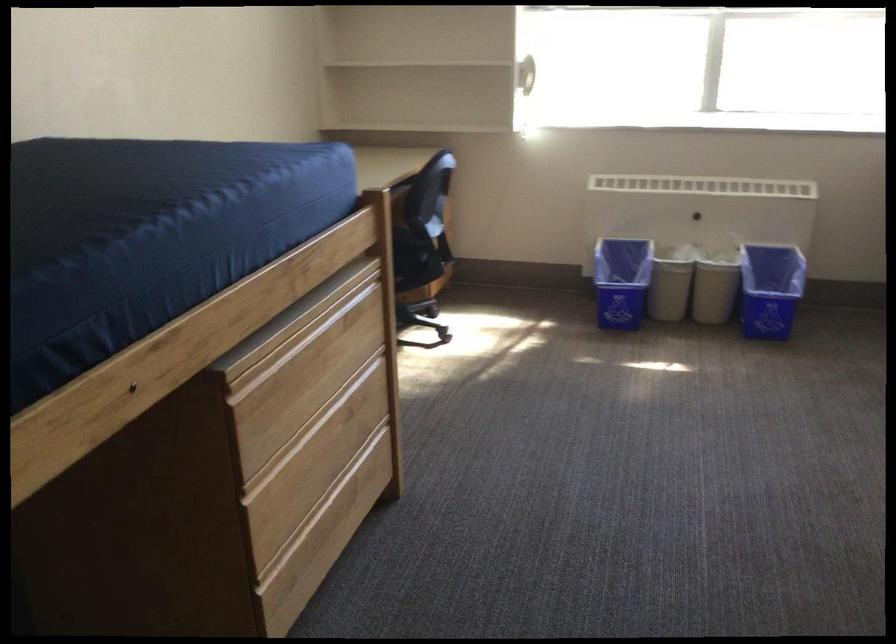
The height and width of the screenshot is (644, 896). What are the coordinates of `chair sitting surface` in the screenshot? It's located at (416, 263).